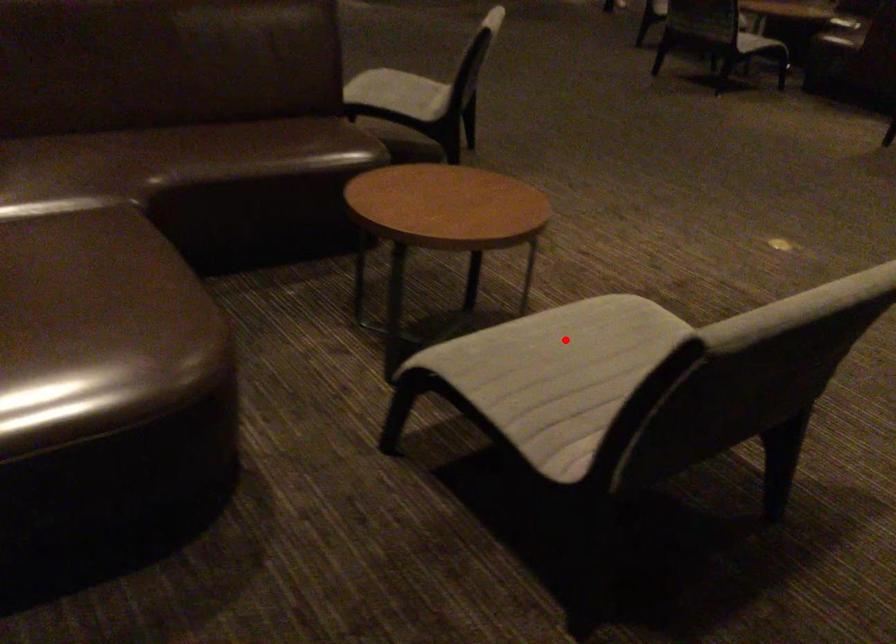
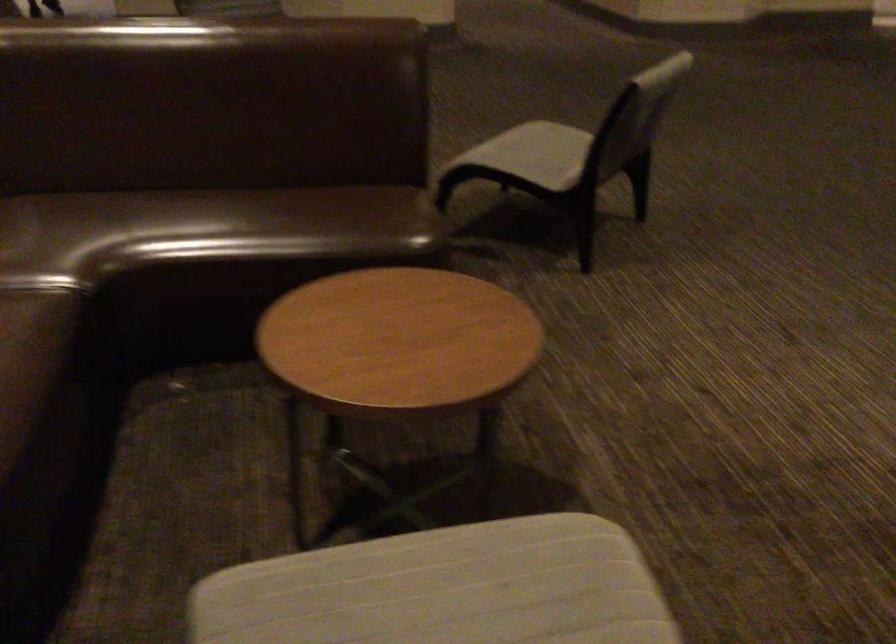
The point at the highlighted location is marked in the first image. Where is the corresponding point in the second image?

(444, 589)